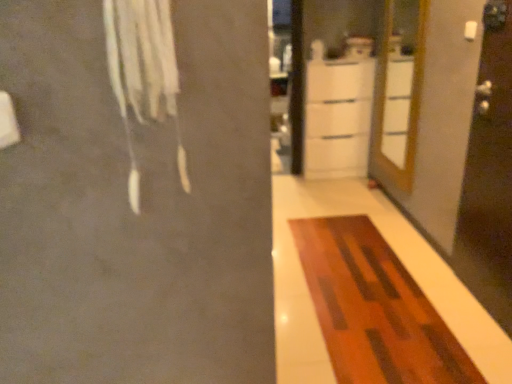
Describe the element at coordinates (489, 175) in the screenshot. Image resolution: width=512 pixels, height=384 pixels. I see `transparent glass screen door at right` at that location.

Locate an element on the screen. white glossy cabinet at center is located at coordinates (337, 117).

What do you see at coordinates (337, 117) in the screenshot? I see `white glossy cabinet at center` at bounding box center [337, 117].

The image size is (512, 384). What do you see at coordinates (398, 90) in the screenshot?
I see `wooden at right` at bounding box center [398, 90].

At what (x,y) coordinates should I click in order to perform the action: click on transparent glass screen door at right. Please return your answer as a coordinate pair (x, y). Looking at the image, I should click on (489, 175).

Visually, is transparent glass screen door at right positioned to the left or to the right of wooden at right?

From the image, it's evident that transparent glass screen door at right is to the right of wooden at right.

Looking at this image, is transparent glass screen door at right far from wooden at right?

transparent glass screen door at right is far away from wooden at right.

From a real-world perspective, does transparent glass screen door at right sit lower than wooden at right?

Yes, from a real-world perspective, transparent glass screen door at right is below wooden at right.

Does transparent glass screen door at right have a smaller size compared to wooden at right?

Indeed, transparent glass screen door at right has a smaller size compared to wooden at right.

In terms of width, does wooden at right look wider or thinner when compared to white glossy cabinet at center?

Clearly, wooden at right has less width compared to white glossy cabinet at center.

Is wooden at right shorter than white glossy cabinet at center?

No.

Would you say white glossy cabinet at center is part of wooden at right's contents?

No, white glossy cabinet at center is not surrounded by wooden at right.

Considering the positions of points (398, 42) and (339, 148), is point (398, 42) farther from camera compared to point (339, 148)?

No, it is not.

Is transparent glass screen door at right not close to white fabric at upper left?

transparent glass screen door at right is far away from white fabric at upper left.

Is transparent glass screen door at right turned away from white fabric at upper left?

No, white fabric at upper left is not at the back of transparent glass screen door at right.

Which of these two, transparent glass screen door at right or white fabric at upper left, is thinner?

white fabric at upper left is thinner.

In the image, is transparent glass screen door at right positioned in front of or behind white fabric at upper left?

Visually, transparent glass screen door at right is located behind white fabric at upper left.

Considering the relative sizes of transparent glass screen door at right and wooden rug at center in the image provided, is transparent glass screen door at right taller than wooden rug at center?

Indeed, transparent glass screen door at right has a greater height compared to wooden rug at center.

Is transparent glass screen door at right inside or outside of wooden rug at center?

transparent glass screen door at right exists outside the volume of wooden rug at center.

Considering the positions of objects transparent glass screen door at right and wooden rug at center in the image provided, who is more to the right, transparent glass screen door at right or wooden rug at center?

Positioned to the right is transparent glass screen door at right.

Is transparent glass screen door at right looking in the opposite direction of wooden rug at center?

No.

Does white glossy cabinet at center have a larger size compared to transparent glass screen door at right?

Yes.

From a real-world perspective, is white glossy cabinet at center located beneath transparent glass screen door at right?

Yes.

Between white glossy cabinet at center and transparent glass screen door at right, which one appears on the left side from the viewer's perspective?

Positioned to the left is white glossy cabinet at center.

Is white glossy cabinet at center far from transparent glass screen door at right?

Yes, white glossy cabinet at center and transparent glass screen door at right are located far from each other.

Which of these two, white fabric at upper left or transparent glass screen door at right, is thinner?

white fabric at upper left.

Is white fabric at upper left at the right side of transparent glass screen door at right?

In fact, white fabric at upper left is to the left of transparent glass screen door at right.

In order to click on screen door that is behind the white fabric at upper left in this screenshot , I will do `click(489, 175)`.

Is wooden rug at center positioned with its back to white glossy cabinet at center?

That's not correct — wooden rug at center is not looking away from white glossy cabinet at center.

Is wooden rug at center in contact with white glossy cabinet at center?

No, wooden rug at center is not with white glossy cabinet at center.

From a real-world perspective, which object rests below the other?

In real-world perspective, wooden rug at center is lower.

This screenshot has height=384, width=512. Identify the location of door on the left of transparent glass screen door at right. (398, 90).

In the image, there is a white glossy cabinet at center. Where is `door above it (from the image's perspective)`? door above it (from the image's perspective) is located at coordinates (398, 90).

Based on their spatial positions, is wooden at right or wooden rug at center closer to white fabric at upper left?

wooden rug at center is closer to white fabric at upper left.

Looking at this image, from the image, which object appears to be farther from white fabric at upper left, transparent glass screen door at right or wooden rug at center?

transparent glass screen door at right is positioned further to the anchor white fabric at upper left.

Which object lies further to the anchor point white glossy cabinet at center, transparent glass screen door at right or wooden at right?

transparent glass screen door at right is further to white glossy cabinet at center.

Looking at the image, which one is located closer to white glossy cabinet at center, wooden at right or wooden rug at center?

wooden at right.

Looking at the image, which one is located closer to white glossy cabinet at center, wooden at right or transparent glass screen door at right?

wooden at right lies closer to white glossy cabinet at center than the other object.

Looking at the image, which one is located further to wooden rug at center, white glossy cabinet at center or transparent glass screen door at right?

white glossy cabinet at center is positioned further to the anchor wooden rug at center.

When comparing their distances from white fabric at upper left, does wooden rug at center or transparent glass screen door at right seem further?

Among the two, transparent glass screen door at right is located further to white fabric at upper left.

In the scene shown: From the image, which object appears to be nearer to white fabric at upper left, wooden at right or white glossy cabinet at center?

wooden at right is positioned closer to the anchor white fabric at upper left.

Identify the location of furniture between white fabric at upper left and white glossy cabinet at center from front to back. This screenshot has width=512, height=384. click(x=375, y=308).

This screenshot has width=512, height=384. In order to click on screen door between white fabric at upper left and white glossy cabinet at center from front to back in this screenshot , I will do `click(489, 175)`.

What are the coordinates of `furniture between white fabric at upper left and wooden at right from front to back` in the screenshot? It's located at (375, 308).

Identify the location of door between transparent glass screen door at right and white glossy cabinet at center in the front-back direction. This screenshot has height=384, width=512. (398, 90).